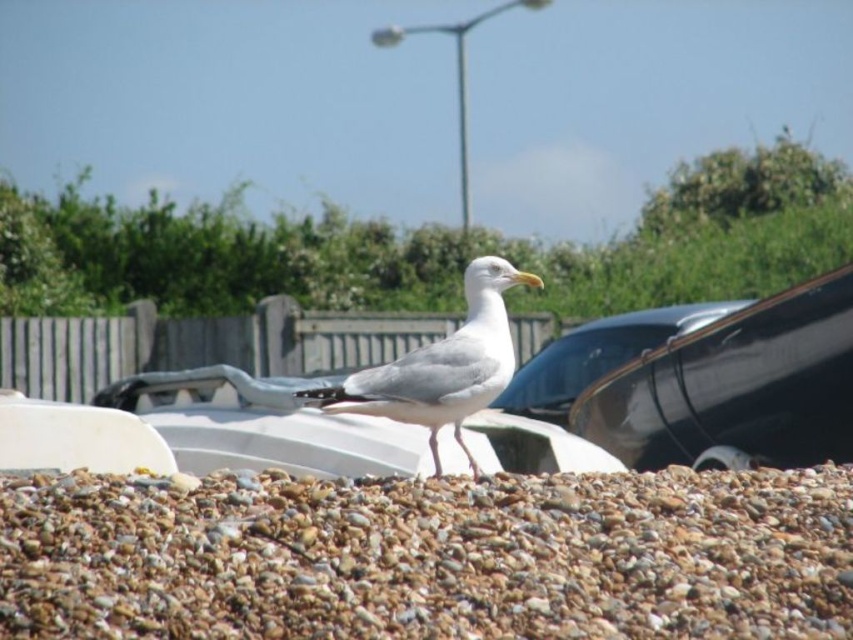
Between white matte seagull at center and glossy black car at center, which one appears on the right side from the viewer's perspective?

From the viewer's perspective, glossy black car at center appears more on the right side.

Who is shorter, white matte seagull at center or glossy black car at center?

With less height is glossy black car at center.

Which is behind, point (381, 406) or point (549, 348)?

The point (549, 348) is behind.

Identify the location of white matte seagull at center. This screenshot has height=640, width=853. (440, 365).

Describe the element at coordinates (430, 557) in the screenshot. The height and width of the screenshot is (640, 853). I see `brown pebbles at center` at that location.

Which is in front, point (260, 637) or point (488, 358)?

Point (260, 637) is in front.

Where is `brown pebbles at center`? This screenshot has width=853, height=640. brown pebbles at center is located at coordinates (430, 557).

You are a GUI agent. You are given a task and a screenshot of the screen. Output one action in this format:
    pyautogui.click(x=<x>, y=<y>)
    Task: Click on the brown pebbles at center
    
    Given the screenshot: What is the action you would take?
    pyautogui.click(x=430, y=557)

Which of these two, brown pebbles at center or glossy black car at center, stands taller?

Standing taller between the two is glossy black car at center.

Is brown pebbles at center thinner than glossy black car at center?

In fact, brown pebbles at center might be wider than glossy black car at center.

This screenshot has height=640, width=853. Describe the element at coordinates (430, 557) in the screenshot. I see `brown pebbles at center` at that location.

This screenshot has height=640, width=853. Find the location of `brown pebbles at center`. brown pebbles at center is located at coordinates (430, 557).